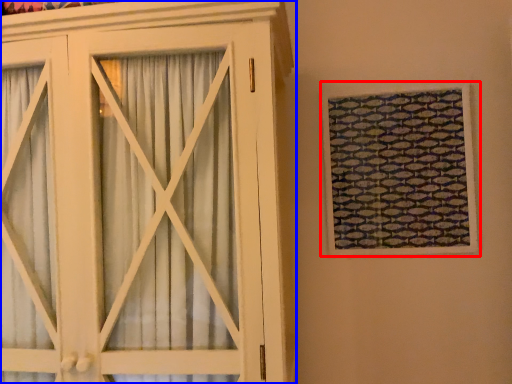
Question: Among these objects, which one is farthest to the camera, window (highlighted by a red box) or cupboard (highlighted by a blue box)?

Choices:
 (A) window
 (B) cupboard

Answer: (A)